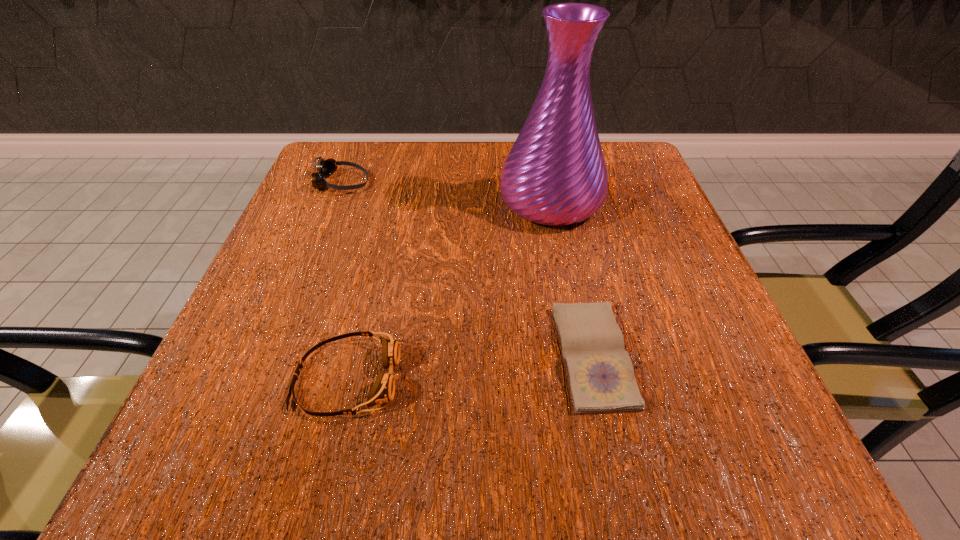
Locate an element on the screen. The image size is (960, 540). vacant area in the image that satisfies the following two spatial constraints: 1. on the front side of the vase; 2. on the left side of the shortest object is located at coordinates (580, 355).

I want to click on free space that satisfies the following two spatial constraints: 1. through the lenses of the farther goggles; 2. on the back side of the shortest object, so click(x=273, y=355).